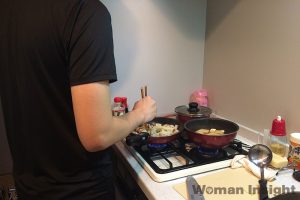
Locate an element on the screen. This screenshot has height=200, width=300. counter top is located at coordinates (162, 189).